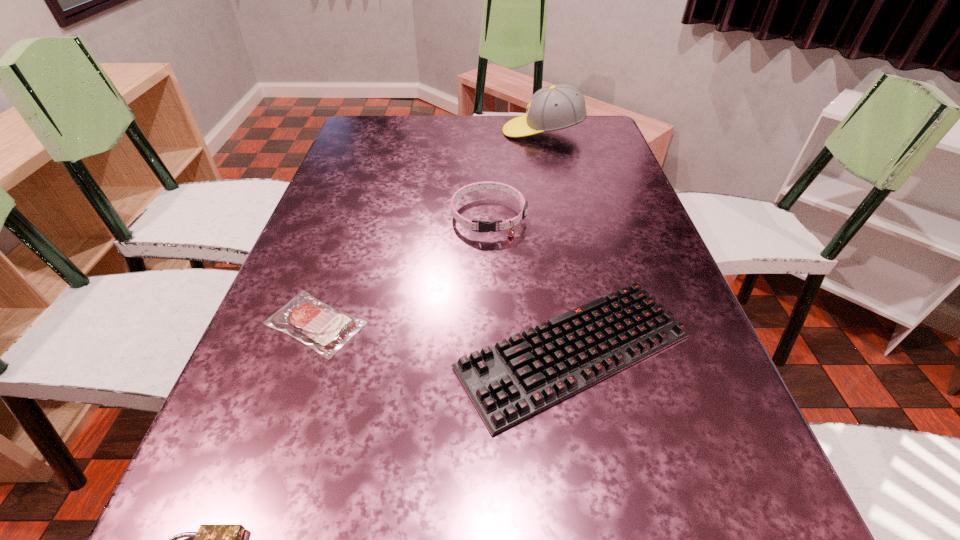
The width and height of the screenshot is (960, 540). What are the coordinates of `the farthest object` in the screenshot? It's located at (559, 106).

At what (x,y) coordinates should I click in order to perform the action: click on baseball cap. Please return your answer as a coordinate pair (x, y). Image resolution: width=960 pixels, height=540 pixels. Looking at the image, I should click on coord(559,106).

You are a GUI agent. You are given a task and a screenshot of the screen. Output one action in this format:
    pyautogui.click(x=<x>, y=<y>)
    Task: Click on the second farthest object
    Image resolution: width=960 pixels, height=540 pixels.
    Given the screenshot: What is the action you would take?
    pyautogui.click(x=483, y=226)

Locate an element on the screen. Image resolution: width=960 pixels, height=540 pixels. dog collar is located at coordinates (483, 226).

Where is `the third tallest object`? the third tallest object is located at coordinates (517, 378).

The height and width of the screenshot is (540, 960). In order to click on steak in this screenshot , I will do click(316, 324).

Find the location of a particular element. vacant space located 0.160m on the front-facing side of the farthest object is located at coordinates (453, 131).

Find the location of `vacant position located on the front-facing side of the farthest object`. vacant position located on the front-facing side of the farthest object is located at coordinates (438, 131).

Where is `free location located on the front-facing side of the farthest object`? The height and width of the screenshot is (540, 960). free location located on the front-facing side of the farthest object is located at coordinates (441, 131).

The height and width of the screenshot is (540, 960). I want to click on vacant region located 0.370m with the buckle on the second farthest object, so click(492, 374).